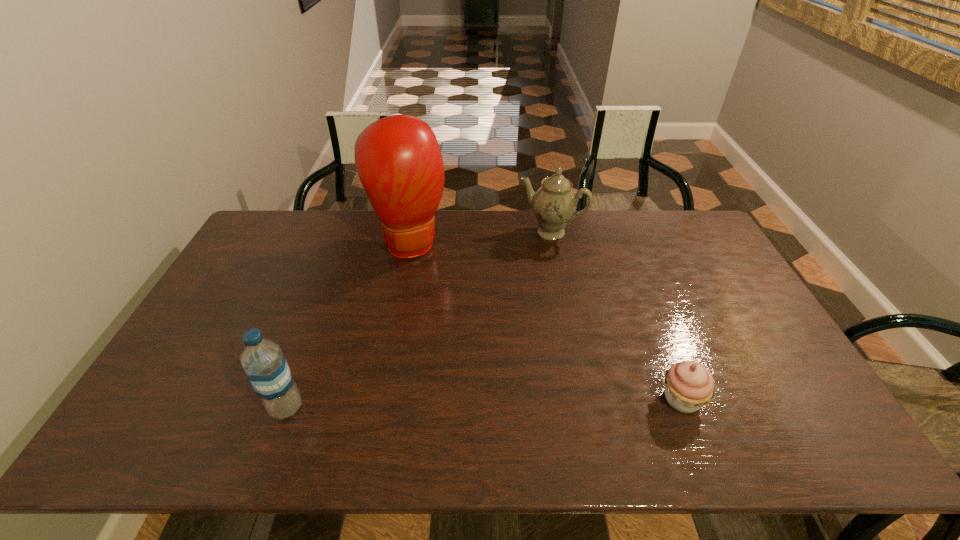
I want to click on water bottle, so click(264, 363).

You are a GUI agent. You are given a task and a screenshot of the screen. Output one action in this format:
    pyautogui.click(x=<x>, y=<y>)
    Task: Click on the rightmost object
    This screenshot has height=540, width=960.
    Given the screenshot: What is the action you would take?
    pyautogui.click(x=689, y=386)

Where is `cupcake`? cupcake is located at coordinates (689, 386).

Find the location of a particular element. The image size is (960, 540). the tallest object is located at coordinates (398, 159).

Where is `boxing glove`? This screenshot has width=960, height=540. boxing glove is located at coordinates (398, 159).

The height and width of the screenshot is (540, 960). Identify the location of chinaware. (554, 204).

Where is `vacant area located on the back of the rightmost object`? This screenshot has width=960, height=540. vacant area located on the back of the rightmost object is located at coordinates (634, 275).

I want to click on free space located 0.340m on the striking surface of the boxing glove, so click(x=457, y=341).

Where is `vacant space located on the striking surface of the boxing glove`? vacant space located on the striking surface of the boxing glove is located at coordinates (433, 290).

You are a GUI agent. You are given a task and a screenshot of the screen. Output one action in this format:
    pyautogui.click(x=<x>, y=<y>)
    Task: Click on the vacant space located 0.060m on the striking surface of the boxing glove
    The image size is (960, 540).
    Given the screenshot: What is the action you would take?
    pyautogui.click(x=427, y=278)